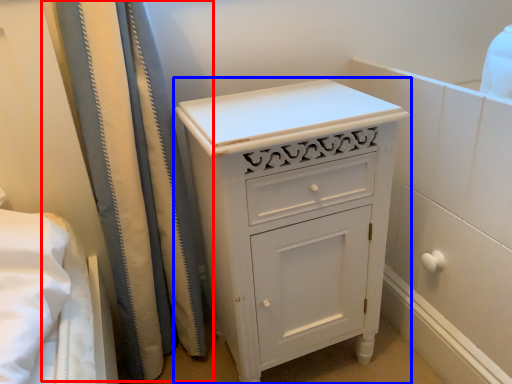
Question: Which object is closer to the camera taking this photo, shower curtain (highlighted by a red box) or chest of drawers (highlighted by a blue box)?

Choices:
 (A) shower curtain
 (B) chest of drawers

Answer: (A)